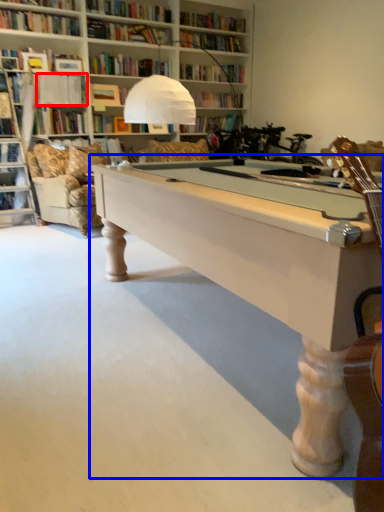
Question: Which object appears farthest to the camera in this image, book (highlighted by a red box) or table (highlighted by a blue box)?

Choices:
 (A) book
 (B) table

Answer: (A)